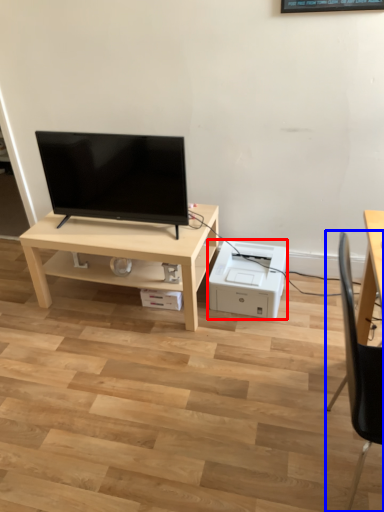
Question: Which object appears closest to the camera in this image, printer (highlighted by a red box) or chair (highlighted by a blue box)?

Choices:
 (A) printer
 (B) chair

Answer: (B)